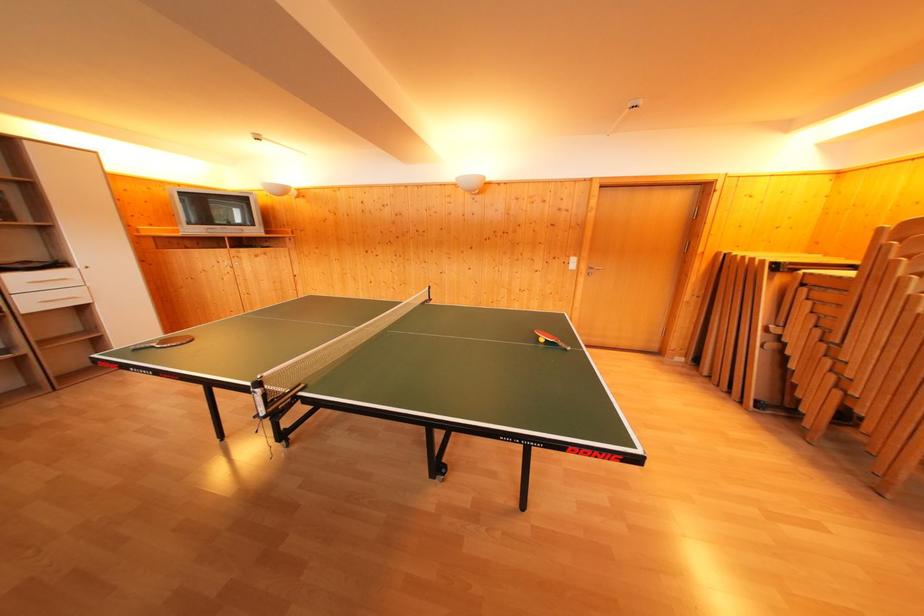
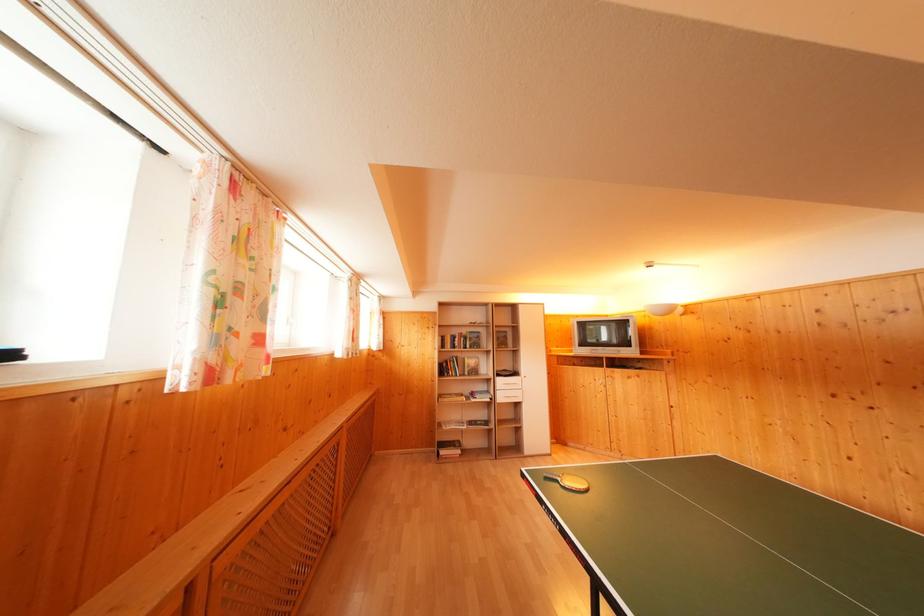
Question: The images are taken continuously from a first-person perspective. In which direction is your viewpoint rotating?

Choices:
 (A) Left
 (B) Right
 (C) Up
 (D) Down

Answer: (A)